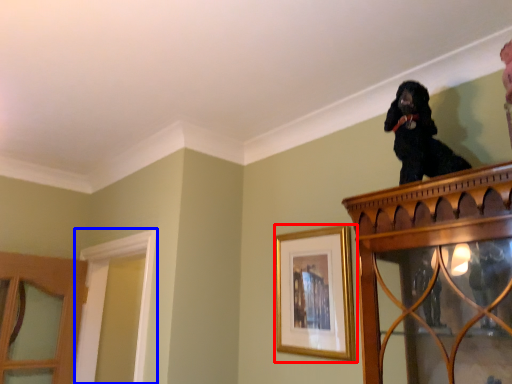
Question: Which point is further to the camera, picture frame (highlighted by a red box) or window frame (highlighted by a blue box)?

Choices:
 (A) picture frame
 (B) window frame

Answer: (B)